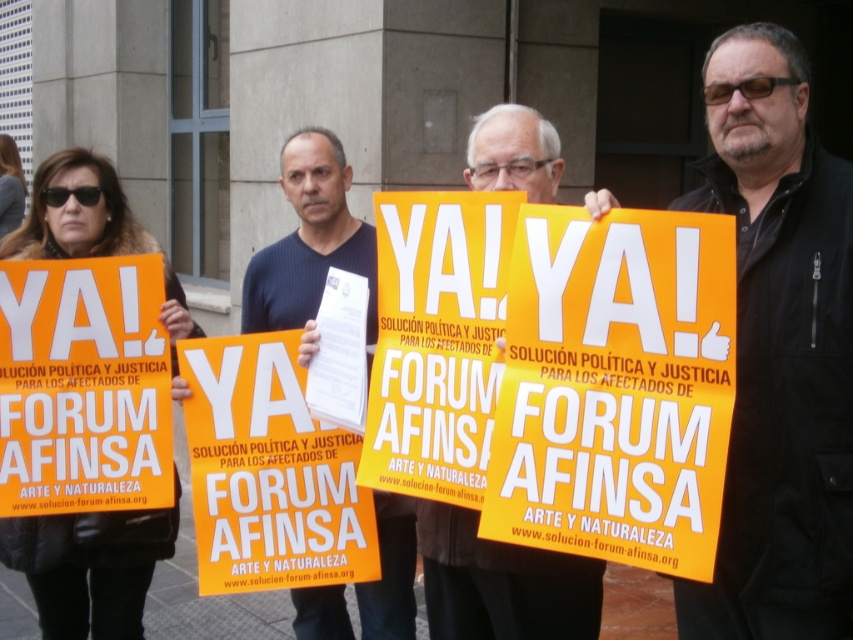
Who is positioned more to the left, orange matte sign at left or dark blue shirt at center?

orange matte sign at left is more to the left.

Who is positioned more to the right, orange matte sign at left or dark blue shirt at center?

dark blue shirt at center

Does point (105, 259) come closer to viewer compared to point (297, 266)?

Yes, it is.

What are the coordinates of `orange matte sign at left` in the screenshot? It's located at (83, 387).

Between orange matte poster at center and matte yellow sign at center, which one has less height?

matte yellow sign at center is shorter.

Is point (270, 433) positioned in front of point (468, 628)?

That is False.

Identify the location of orange matte poster at center. Image resolution: width=853 pixels, height=640 pixels. (270, 472).

Is orange matte sign at center bigger than matte yellow sign at center?

Yes, orange matte sign at center is bigger than matte yellow sign at center.

Who is lower down, orange matte sign at center or matte yellow sign at center?

matte yellow sign at center is below.

Between point (711, 316) and point (494, 145), which one is positioned in front?

Point (711, 316)

This screenshot has width=853, height=640. Identify the location of orange matte sign at center. click(614, 387).